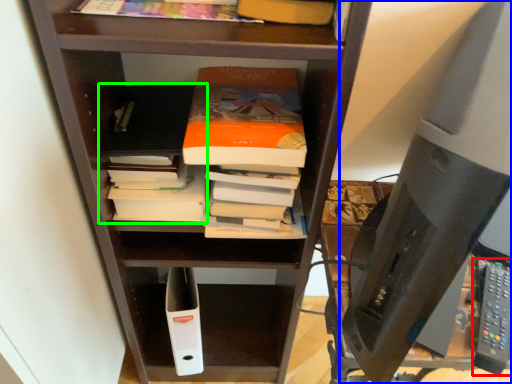
Question: Which object is the closest to the remote (highlighted by a red box)? Choose among these: desktop computer (highlighted by a blue box) or book (highlighted by a green box).

Choices:
 (A) desktop computer
 (B) book

Answer: (A)